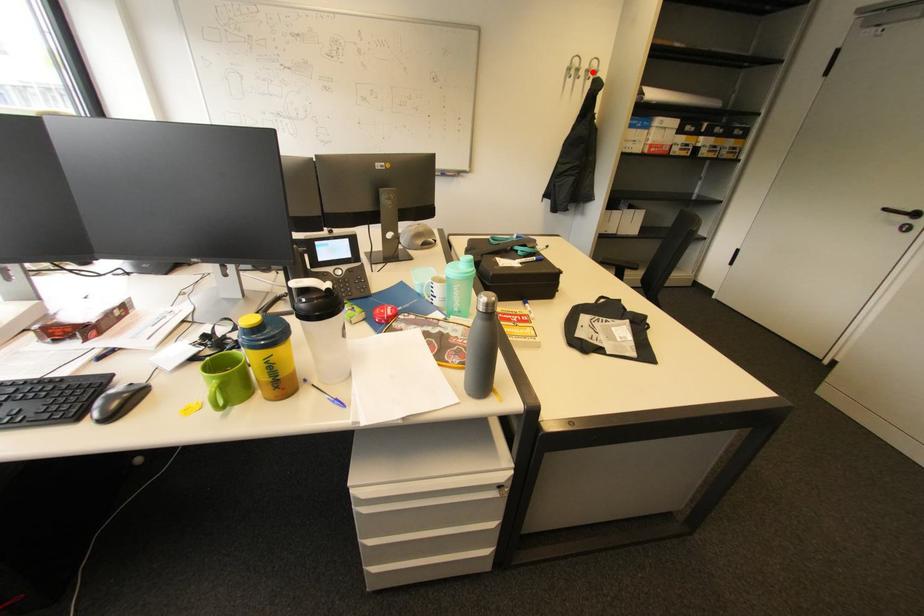
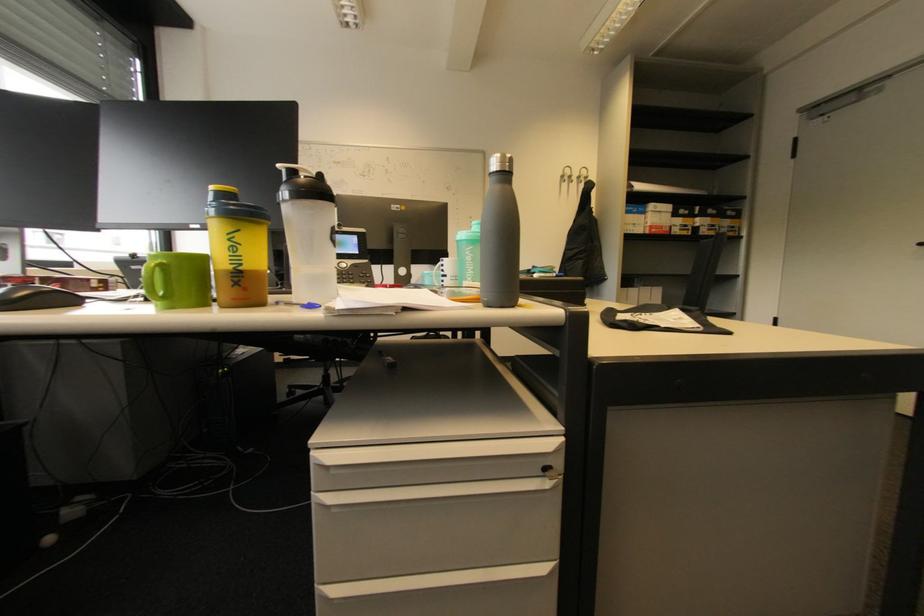
Where in the second image is the point corresponding to the highlighted location from the first image?

(584, 177)